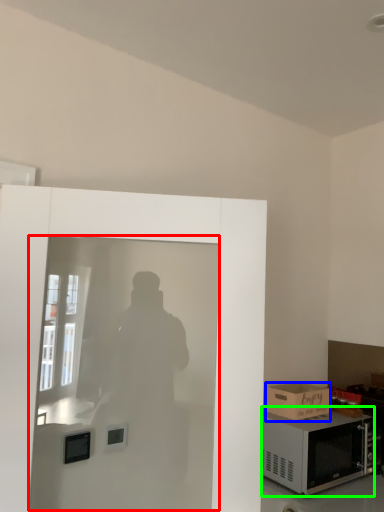
Question: Which object is the farthest from screen door (highlighted by a red box)? Choose among these: box (highlighted by a blue box) or microwave oven (highlighted by a green box).

Choices:
 (A) box
 (B) microwave oven

Answer: (A)